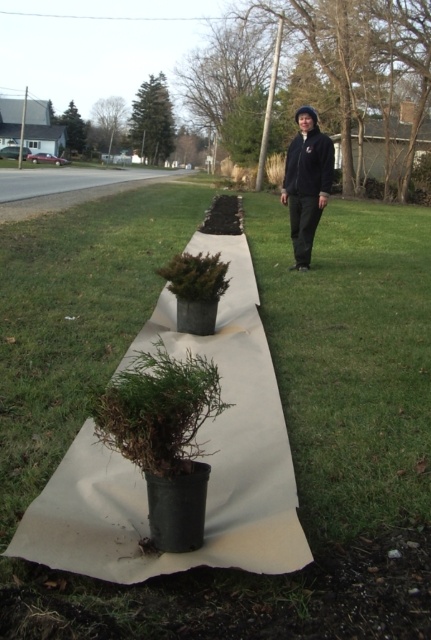
Can you confirm if brown textured tree at upper center is smaller than green textured evergreen tree at upper center?

Incorrect, brown textured tree at upper center is not smaller in size than green textured evergreen tree at upper center.

Is brown textured tree at upper center wider than green textured evergreen tree at upper center?

Yes, brown textured tree at upper center is wider than green textured evergreen tree at upper center.

This screenshot has width=431, height=640. In order to click on brown textured tree at upper center in this screenshot , I will do `click(316, 77)`.

Where is `brown textured tree at upper center`? brown textured tree at upper center is located at coordinates (316, 77).

Which is in front, point (322, 180) or point (75, 122)?

Point (322, 180) is more forward.

Can you confirm if black fleece jacket at center is smaller than green leafy tree at upper left?

Yes, black fleece jacket at center is smaller than green leafy tree at upper left.

Between point (308, 250) and point (71, 124), which one is positioned in front?

Positioned in front is point (308, 250).

At what (x,y) coordinates should I click in order to perform the action: click on black fleece jacket at center. Please return your answer as a coordinate pair (x, y). This screenshot has width=431, height=640. Looking at the image, I should click on (306, 182).

Who is positioned more to the right, black fleece jacket at center or green matte tree at upper center?

black fleece jacket at center is more to the right.

At what (x,y) coordinates should I click in order to perform the action: click on black fleece jacket at center. Please return your answer as a coordinate pair (x, y). Looking at the image, I should click on (306, 182).